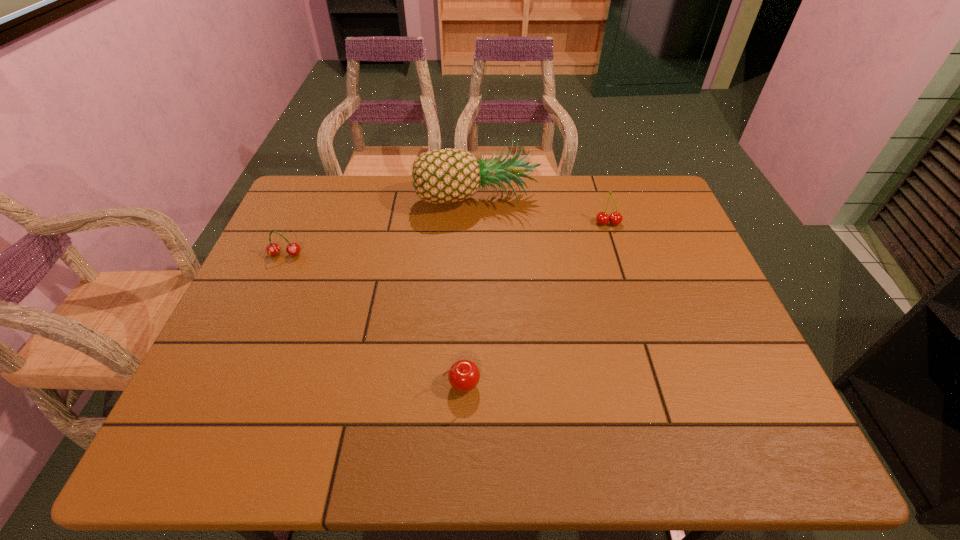
The height and width of the screenshot is (540, 960). I want to click on vacant space located on the right of the nearest object, so coord(667,385).

Find the location of a particular element. The width and height of the screenshot is (960, 540). pineapple present at the far edge is located at coordinates (448, 175).

Where is `cherry that is at the far edge`? cherry that is at the far edge is located at coordinates coord(602,218).

Locate an element on the screen. The width and height of the screenshot is (960, 540). object that is at the left edge is located at coordinates (272, 249).

At what (x,y) coordinates should I click in order to perform the action: click on free location at the far edge of the desktop. Please return your answer as a coordinate pair (x, y). This screenshot has height=540, width=960. Looking at the image, I should click on (524, 179).

At what (x,y) coordinates should I click in order to perform the action: click on vacant space at the near edge of the desktop. Please return your answer as a coordinate pair (x, y). The image size is (960, 540). Looking at the image, I should click on (680, 430).

This screenshot has width=960, height=540. Identify the location of free space at the left edge of the desktop. (274, 349).

The image size is (960, 540). In the image, there is a desktop. Identify the location of free space at the right edge. (708, 410).

Where is `vacant region at the near left corner of the desktop`? The image size is (960, 540). vacant region at the near left corner of the desktop is located at coordinates (175, 443).

Find the location of a particular element. unoccupied area between the nearest object and the pineapple is located at coordinates tap(469, 291).